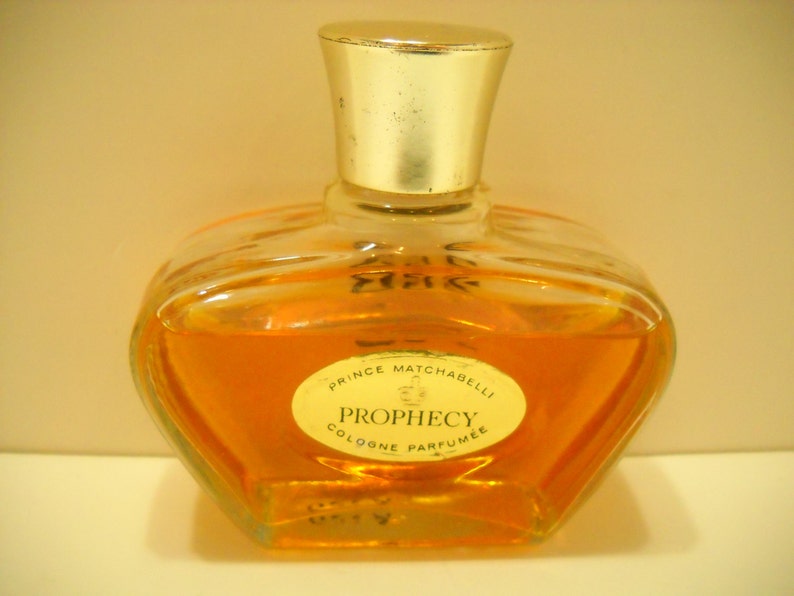
Where is `floor`? This screenshot has width=794, height=596. floor is located at coordinates (105, 490).